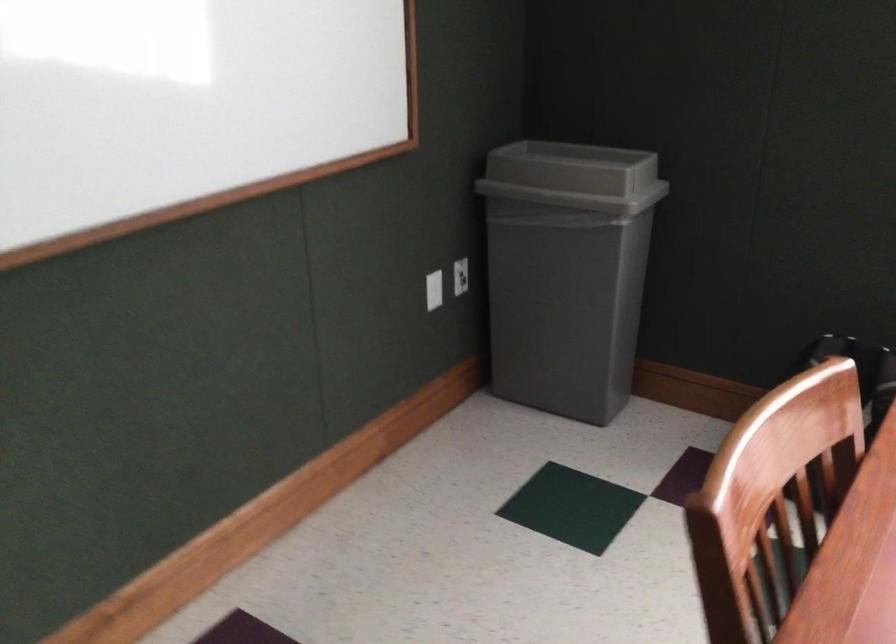
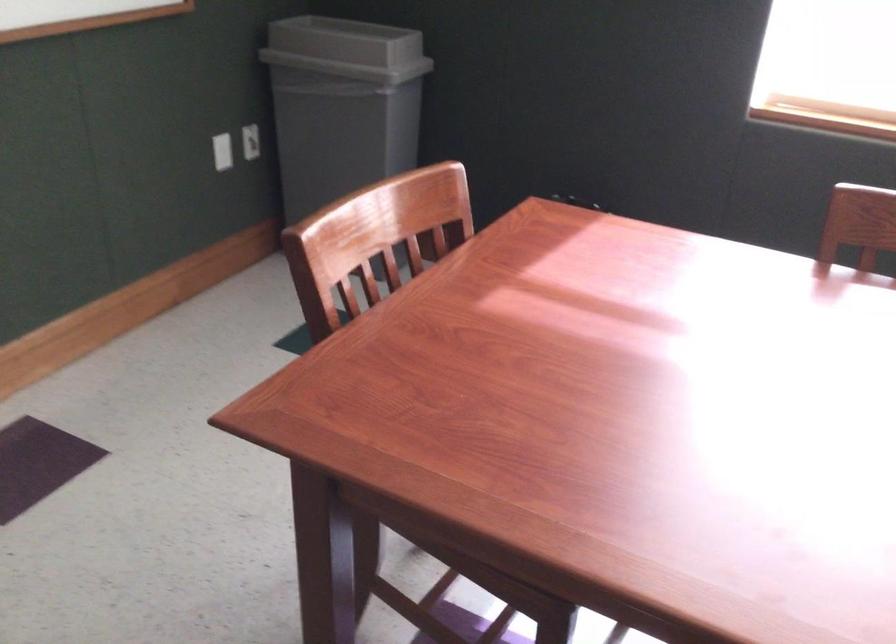
The point at (574, 178) is marked in the first image. Where is the corresponding point in the second image?

(346, 49)